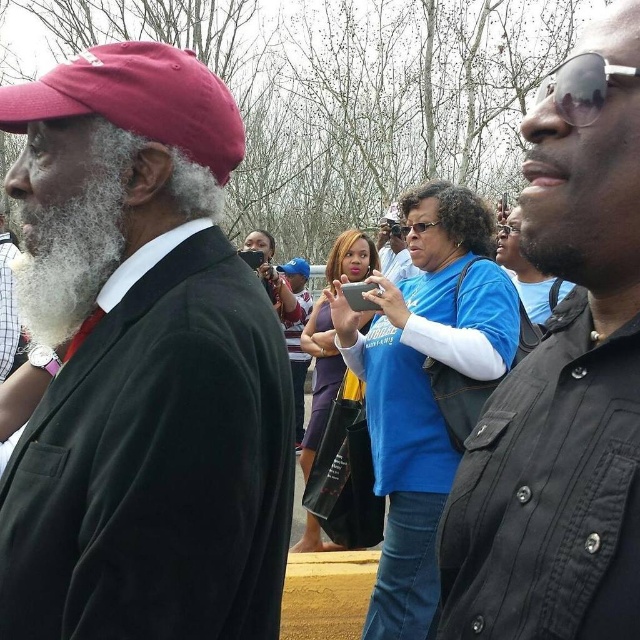
Which is behind, point (132, 529) or point (106, 154)?

The point (106, 154) is more distant.

Is matte red cap at left wider than white fluffy beard at left?

Indeed, matte red cap at left has a greater width compared to white fluffy beard at left.

You are a GUI agent. You are given a task and a screenshot of the screen. Output one action in this format:
    pyautogui.click(x=<x>, y=<y>)
    Task: Click on the matte red cap at left
    The height and width of the screenshot is (640, 640).
    Given the screenshot: What is the action you would take?
    pyautogui.click(x=141, y=365)

Identify the location of matte red cap at left. The width and height of the screenshot is (640, 640). pos(141,365).

Is black matte shirt at right thinner than clear plastic goggles at center?

Correct, black matte shirt at right's width is less than clear plastic goggles at center's.

Looking at this image, who is lower down, black matte shirt at right or clear plastic goggles at center?

black matte shirt at right

The height and width of the screenshot is (640, 640). Find the location of `black matte shirt at right`. black matte shirt at right is located at coordinates (563, 380).

Where is `matte red cap at left`? matte red cap at left is located at coordinates (141, 365).

Does matte red cap at left have a greater width compared to clear plastic goggles at center?

Yes, matte red cap at left is wider than clear plastic goggles at center.

Is point (19, 460) positioned in front of point (516, 227)?

Yes.

You are a GUI agent. You are given a task and a screenshot of the screen. Output one action in this format:
    pyautogui.click(x=<x>, y=<y>)
    Task: Click on the matte red cap at left
    
    Given the screenshot: What is the action you would take?
    pyautogui.click(x=141, y=365)